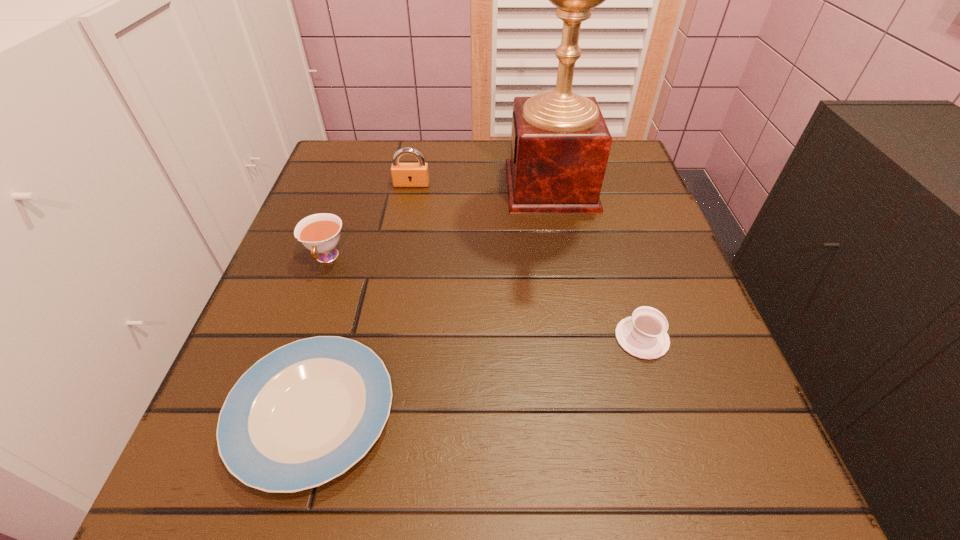
You are a GUI agent. You are given a task and a screenshot of the screen. Output one action in this format:
    pyautogui.click(x=<x>, y=<y>)
    Task: Click on the trophy cup
    
    Given the screenshot: What is the action you would take?
    pyautogui.click(x=560, y=143)

Image resolution: width=960 pixels, height=540 pixels. In order to click on padlock in this screenshot , I will do `click(403, 174)`.

Find the location of a particular element. Image resolution: width=960 pixels, height=540 pixels. the farther teacup is located at coordinates (320, 233).

Where is `the left teacup`? the left teacup is located at coordinates (320, 233).

At what (x,y) coordinates should I click in order to perform the action: click on the right teacup. Please return your answer as a coordinate pair (x, y). Image resolution: width=960 pixels, height=540 pixels. Looking at the image, I should click on (644, 335).

Locate an element on the screen. the second shortest object is located at coordinates (644, 335).

Find the location of a particular element. The image size is (960, 540). plate is located at coordinates (304, 414).

The width and height of the screenshot is (960, 540). I want to click on vacant point located on the plaque of the trophy cup, so click(481, 186).

What are the coordinates of `free space located 0.200m on the plaque of the trophy cup` in the screenshot? It's located at (420, 186).

At what (x,y) coordinates should I click in order to perform the action: click on free space located 0.050m on the plaque of the trophy cup. Please return your answer as a coordinate pair (x, y). Looking at the image, I should click on (485, 186).